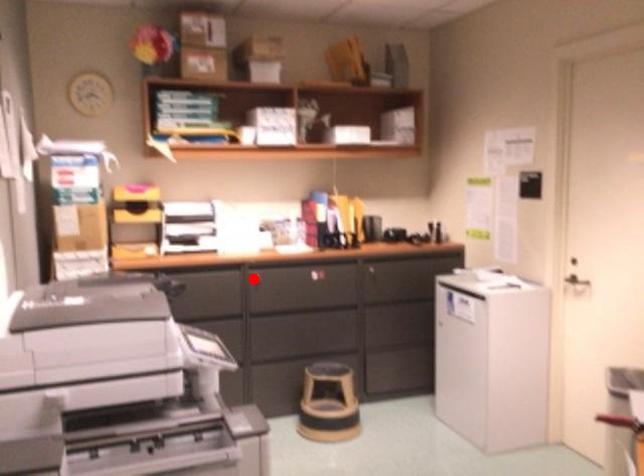
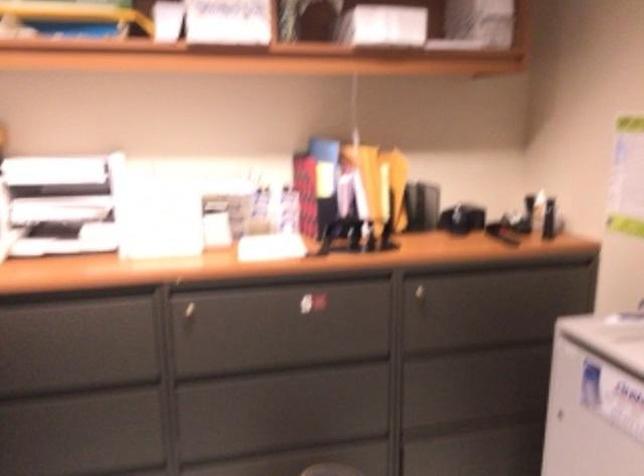
Question: A red point is marked in image1. In image2, is the corresponding 3D point closer to the camera or farther? Reply with the corresponding letter.

Choices:
 (A) The corresponding 3D point is closer.
 (B) The corresponding 3D point is farther.

Answer: (A)